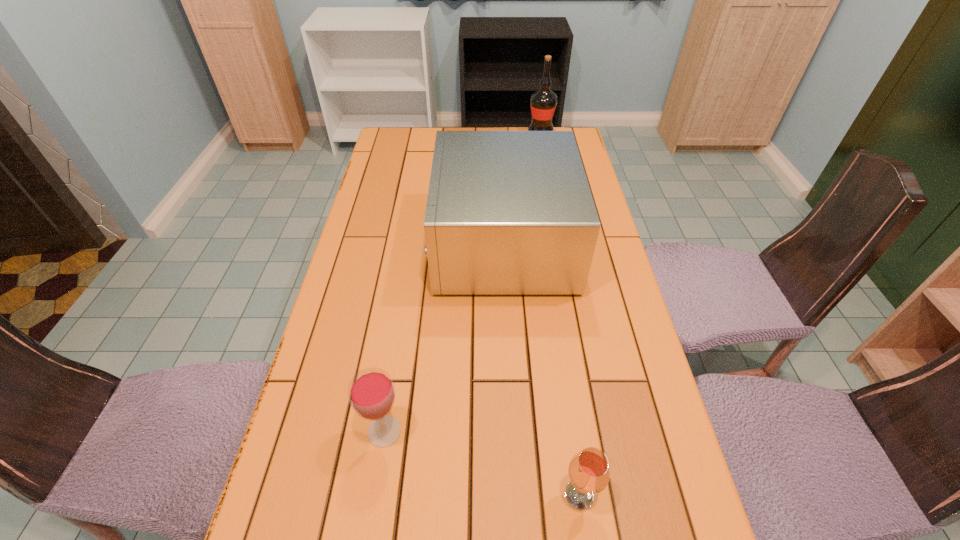
Locate an element on the screen. The width and height of the screenshot is (960, 540). vacant region that satisfies the following two spatial constraints: 1. on the back side of the wine bottle; 2. on the right side of the right wineglass is located at coordinates (526, 132).

Where is `free spot that satisfies the following two spatial constraints: 1. on the back side of the leftmost object; 2. on the left side of the farthest object`? The width and height of the screenshot is (960, 540). free spot that satisfies the following two spatial constraints: 1. on the back side of the leftmost object; 2. on the left side of the farthest object is located at coordinates (431, 132).

Where is `vacant area in the image that satisfies the following two spatial constraints: 1. with the door open on the nearest object; 2. on the right side of the microwave oven`? This screenshot has height=540, width=960. vacant area in the image that satisfies the following two spatial constraints: 1. with the door open on the nearest object; 2. on the right side of the microwave oven is located at coordinates (516, 495).

Where is `blank area in the image that satisfies the following two spatial constraints: 1. with the door open on the shortest object; 2. on the right side of the microwave oven`? blank area in the image that satisfies the following two spatial constraints: 1. with the door open on the shortest object; 2. on the right side of the microwave oven is located at coordinates (516, 495).